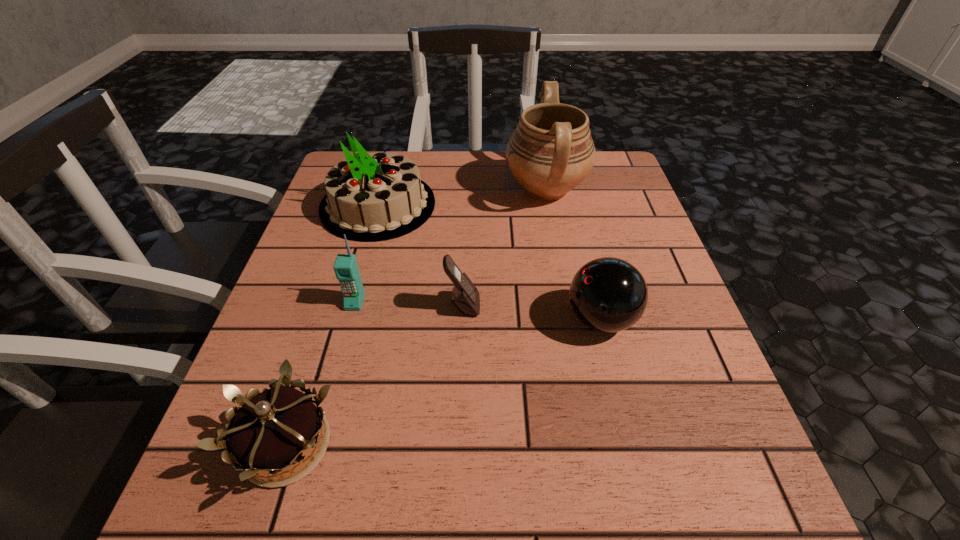
Locate an element on the screen. The width and height of the screenshot is (960, 540). free space located 0.390m on the right of the second tallest object is located at coordinates (595, 205).

Find the location of a particular element. Image resolution: width=960 pixels, height=540 pixels. vacant space located on the keypad of the left cellular telephone is located at coordinates (345, 341).

Where is `vacant point located on the surface of the bowling ball near the finger holes`? The image size is (960, 540). vacant point located on the surface of the bowling ball near the finger holes is located at coordinates (355, 319).

At what (x,y) coordinates should I click in order to perform the action: click on vacant space located 0.380m on the surface of the bowling ball near the finger holes. Please return your answer as a coordinate pair (x, y). The height and width of the screenshot is (540, 960). Looking at the image, I should click on coord(361,319).

Where is `free space located on the surface of the bowling ball near the finger holes`? The image size is (960, 540). free space located on the surface of the bowling ball near the finger holes is located at coordinates coord(394,319).

Where is `free spot located on the front-facing side of the shorter cellular telephone`? This screenshot has width=960, height=540. free spot located on the front-facing side of the shorter cellular telephone is located at coordinates (548, 305).

At what (x,y) coordinates should I click in order to perform the action: click on blank space located 0.130m on the back of the crown. Please return your answer as a coordinate pair (x, y). Image resolution: width=960 pixels, height=540 pixels. Looking at the image, I should click on coord(324,329).

Locate an element on the screen. This screenshot has height=540, width=960. urn that is at the far edge is located at coordinates (551, 151).

At what (x,y) coordinates should I click in order to perform the action: click on birthday cake present at the far edge. Please return your answer as a coordinate pair (x, y). This screenshot has width=960, height=540. Looking at the image, I should click on (x=370, y=197).

Where is `object at the near edge`? The width and height of the screenshot is (960, 540). object at the near edge is located at coordinates (274, 429).